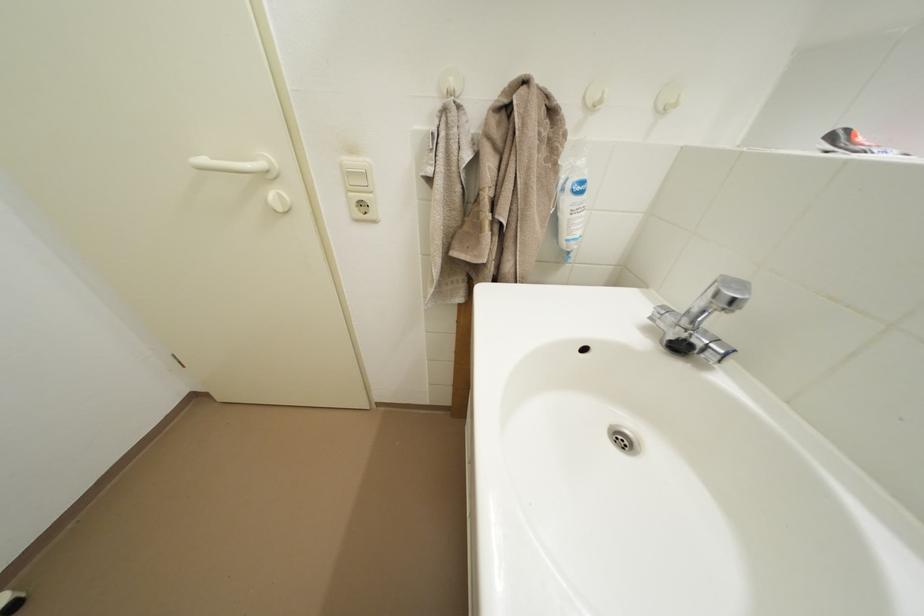
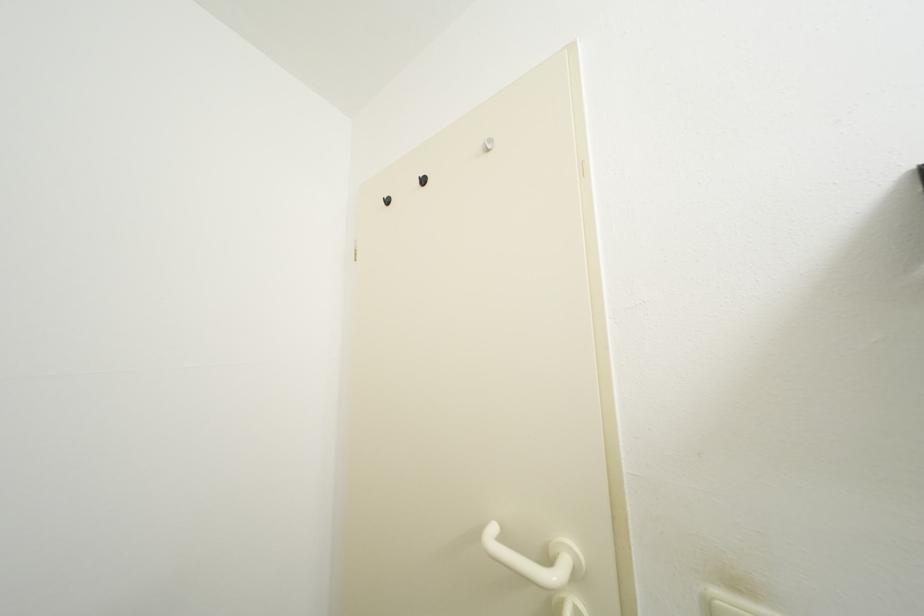
Based on the continuous images, in which direction is the camera rotating?

The camera's rotation is toward left-up.